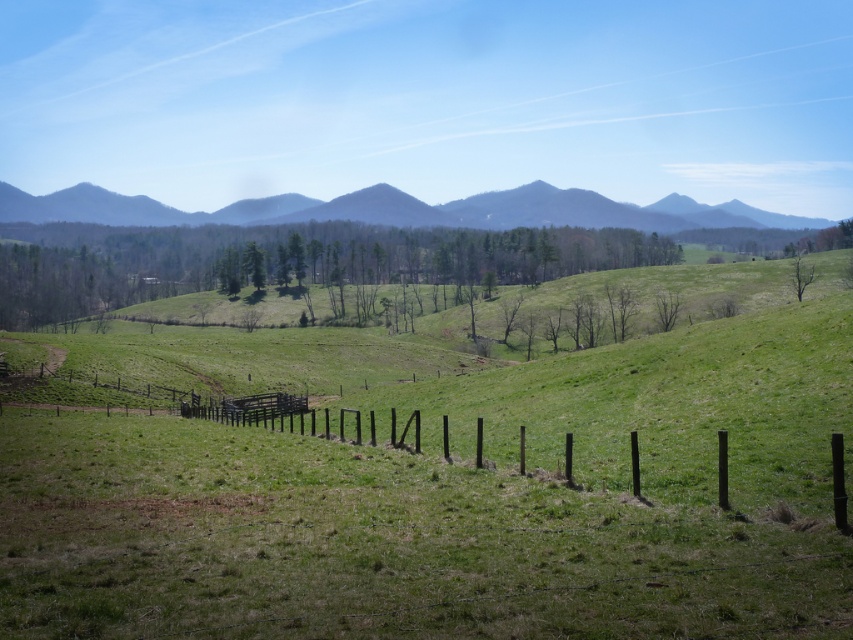
Is brown wooden fence at center to the left of green leafy trees at center from the viewer's perspective?

In fact, brown wooden fence at center is to the right of green leafy trees at center.

Can you confirm if brown wooden fence at center is shorter than green leafy trees at center?

Correct, brown wooden fence at center is not as tall as green leafy trees at center.

This screenshot has width=853, height=640. In order to click on brown wooden fence at center in this screenshot , I will do `click(461, 490)`.

Locate an element on the screen. Image resolution: width=853 pixels, height=640 pixels. brown wooden fence at center is located at coordinates (461, 490).

Does grayish-blue mountain range at upper center have a greater height compared to green leafy tree at upper right?

Correct, grayish-blue mountain range at upper center is much taller as green leafy tree at upper right.

Who is more distant from viewer, (709, 211) or (809, 266)?

The point (709, 211) is behind.

Is point (166, 221) farther from camera compared to point (811, 266)?

That is True.

Find the location of a particular element. The image size is (853, 640). grayish-blue mountain range at upper center is located at coordinates (399, 209).

Does green leafy trees at center appear on the left side of grayish-blue mountain range at upper center?

Indeed, green leafy trees at center is positioned on the left side of grayish-blue mountain range at upper center.

Measure the distance between point (589, 250) and camera.

Point (589, 250) and camera are 279.16 meters apart.

Where is `green leafy trees at center`? This screenshot has width=853, height=640. green leafy trees at center is located at coordinates (294, 260).